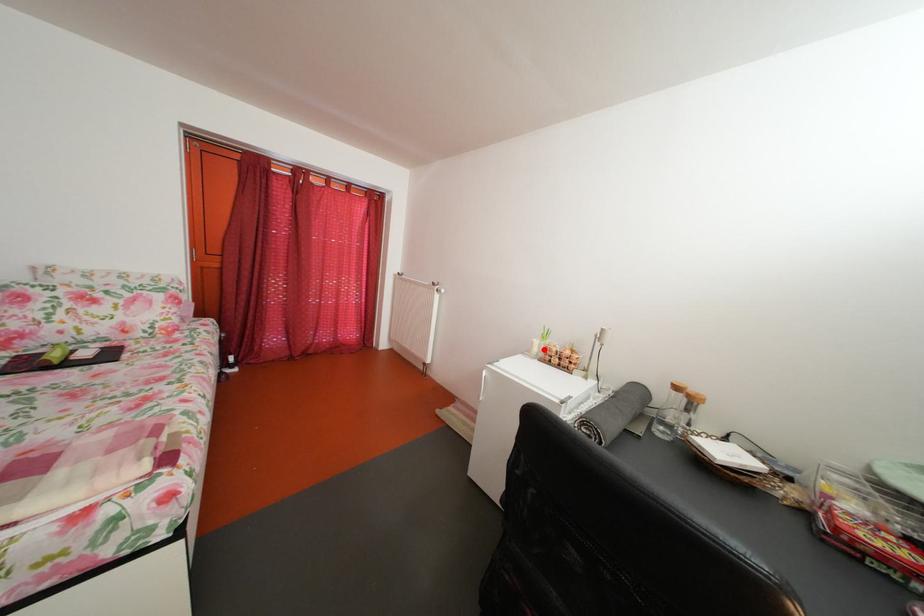
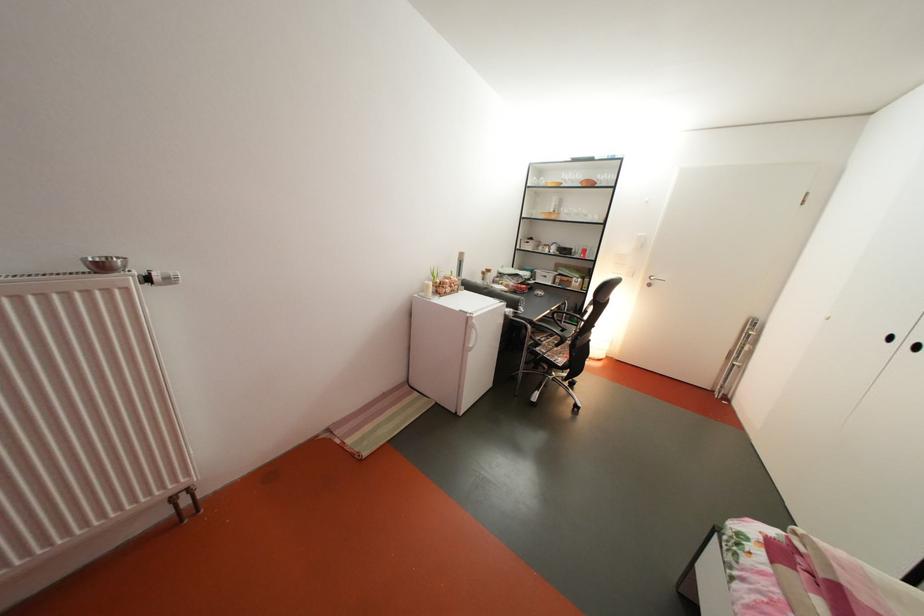
The point at the highlighted location is marked in the first image. Where is the corresponding point in the second image?

(439, 293)